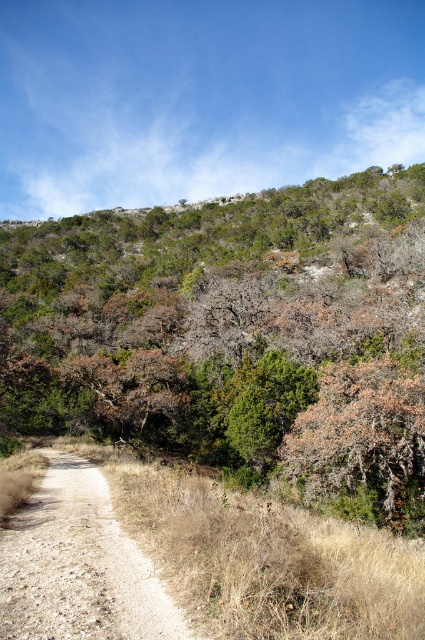
Does green leafy tree at center have a greater width compared to brown gravel path at lower left?

Correct, the width of green leafy tree at center exceeds that of brown gravel path at lower left.

Can you confirm if green leafy tree at center is positioned above brown gravel path at lower left?

Indeed, green leafy tree at center is positioned over brown gravel path at lower left.

Between point (238, 280) and point (64, 484), which one is positioned behind?

The point (238, 280) is more distant.

Where is `green leafy tree at center`? green leafy tree at center is located at coordinates click(x=235, y=333).